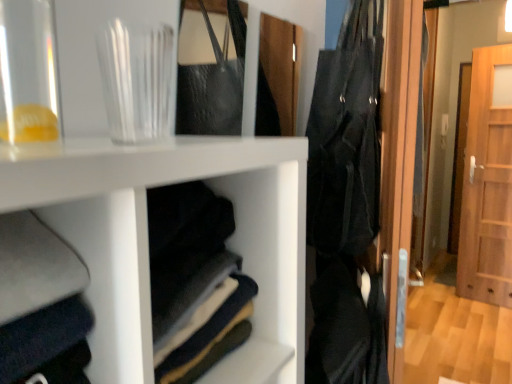
Question: From the image's perspective, would you say black fabric bag at right is shown under wooden door at right?

Choices:
 (A) no
 (B) yes

Answer: (A)

Question: Does black fabric bag at right lie in front of wooden door at right?

Choices:
 (A) yes
 (B) no

Answer: (A)

Question: Would you say wooden door at right is part of black fabric bag at right's contents?

Choices:
 (A) no
 (B) yes

Answer: (A)

Question: Is black fabric bag at right at the left side of wooden door at right?

Choices:
 (A) yes
 (B) no

Answer: (A)

Question: Is black fabric bag at right thinner than wooden door at right?

Choices:
 (A) no
 (B) yes

Answer: (A)

Question: From the image's perspective, would you say black fabric bag at right is positioned over wooden door at right?

Choices:
 (A) no
 (B) yes

Answer: (B)

Question: Would you consider transparent glass at upper left, marked as the first glass vase in a right-to-left arrangement, to be distant from wooden door at right?

Choices:
 (A) yes
 (B) no

Answer: (A)

Question: Could you tell me if transparent glass at upper left, which appears as the second glass vase when viewed from the front, is facing wooden door at right?

Choices:
 (A) yes
 (B) no

Answer: (B)

Question: From the image's perspective, is transparent glass at upper left, marked as the first glass vase in a right-to-left arrangement, on wooden door at right?

Choices:
 (A) yes
 (B) no

Answer: (A)

Question: From the image's perspective, is transparent glass at upper left, arranged as the second glass vase when viewed from the left, located beneath wooden door at right?

Choices:
 (A) no
 (B) yes

Answer: (A)

Question: Is transparent glass at upper left, which ranks as the first glass vase in back-to-front order, bigger than wooden door at right?

Choices:
 (A) no
 (B) yes

Answer: (A)

Question: From a real-world perspective, is transparent glass at upper left, which appears as the second glass vase when viewed from the front, positioned under wooden door at right based on gravity?

Choices:
 (A) no
 (B) yes

Answer: (A)

Question: Does black fabric bag at right have a greater width compared to transparent glass jar at upper left, which ranks as the 2th glass vase in back-to-front order?

Choices:
 (A) yes
 (B) no

Answer: (A)